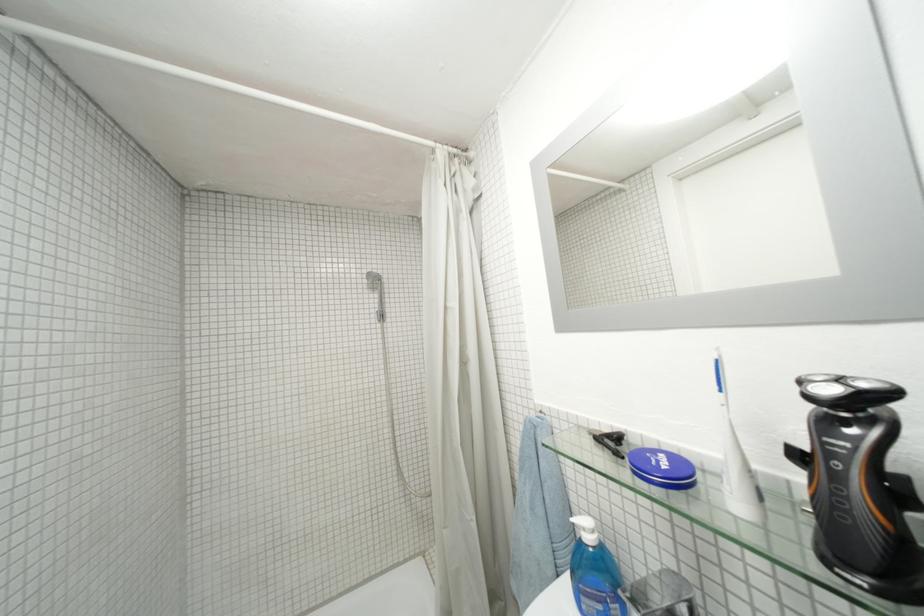
This screenshot has height=616, width=924. In order to click on blue container lid in this screenshot , I will do `click(662, 468)`.